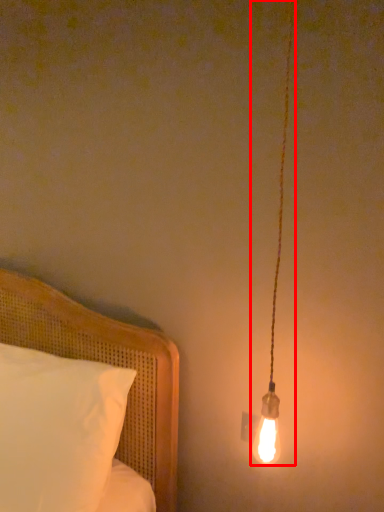
Question: From the image's perspective, what is the correct spatial relationship of lamp (annotated by the red box) in relation to bed?

Choices:
 (A) below
 (B) above

Answer: (B)